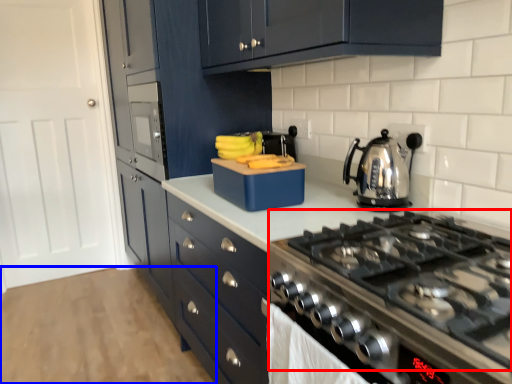
Question: Among these objects, which one is farthest to the camera, gas stove (highlighted by a red box) or plain (highlighted by a blue box)?

Choices:
 (A) gas stove
 (B) plain

Answer: (B)